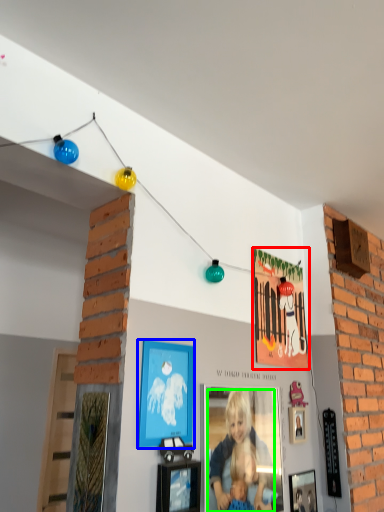
Question: Which object is the closest to the picture frame (highlighted by a red box)? Choose among these: picture frame (highlighted by a blue box) or person (highlighted by a green box).

Choices:
 (A) picture frame
 (B) person

Answer: (B)